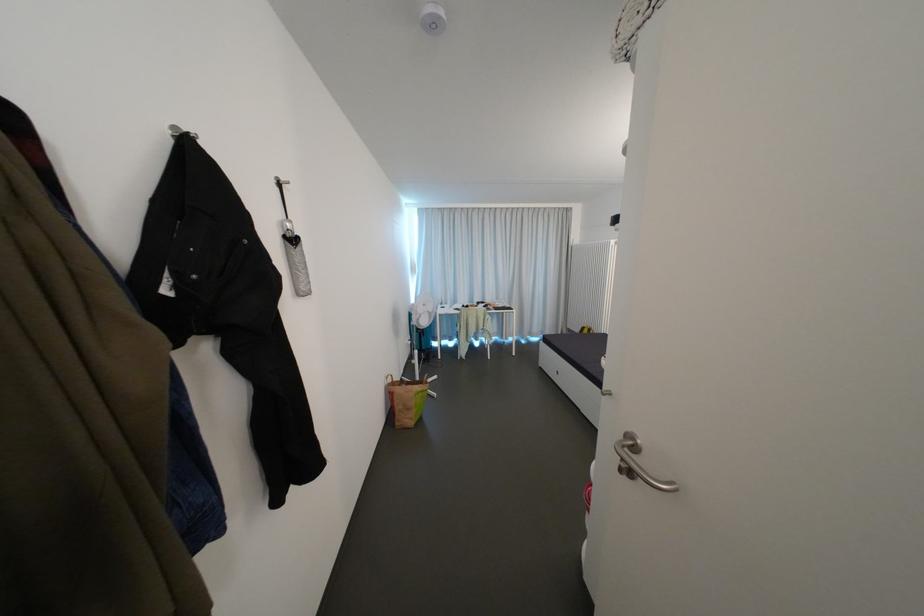
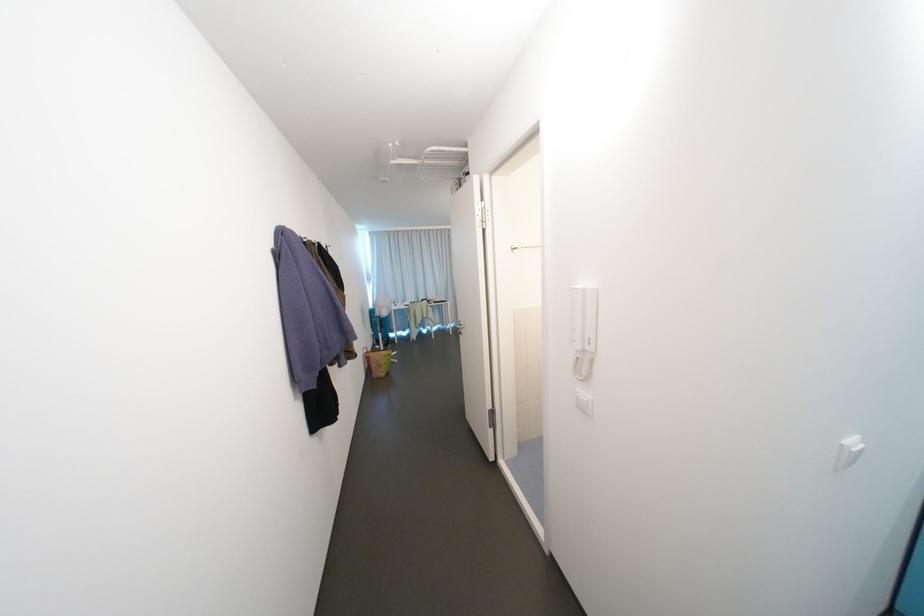
The point at (x=406, y=408) is marked in the first image. Where is the corresponding point in the second image?

(381, 367)